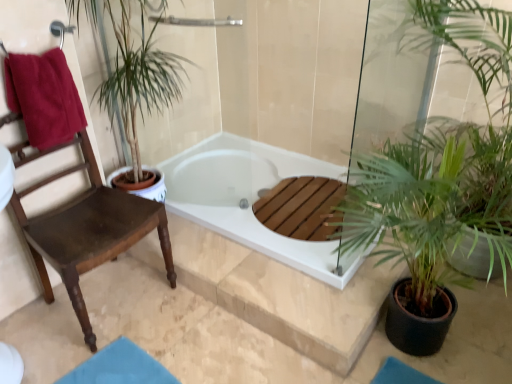
The height and width of the screenshot is (384, 512). I want to click on maroon cotton towel at left, so click(44, 97).

This screenshot has width=512, height=384. I want to click on white glossy bathtub at center, so click(250, 199).

Can you confirm if green leafy plant at right is smaller than maroon cotton towel at left?

No.

What's the angular difference between green leafy plant at right and maroon cotton towel at left's facing directions?

The angle between the facing direction of green leafy plant at right and the facing direction of maroon cotton towel at left is 89.3 degrees.

At what (x,y) coordinates should I click in order to perform the action: click on beach towel behind the green leafy plant at right. Please return your answer as a coordinate pair (x, y). Looking at the image, I should click on (44, 97).

From a real-world perspective, which is physically below, green leafy plant at right or maroon cotton towel at left?

In real-world perspective, green leafy plant at right is lower.

You are a GUI agent. You are given a task and a screenshot of the screen. Output one action in this format:
    pyautogui.click(x=<x>, y=<y>)
    Task: Click on the chair below the maroon cotton towel at left (from the image's perspective)
    
    Given the screenshot: What is the action you would take?
    pyautogui.click(x=86, y=228)

From the image's perspective, which object appears higher, wooden chair at left or maroon cotton towel at left?

maroon cotton towel at left, from the image's perspective.

Does wooden chair at left have a larger size compared to maroon cotton towel at left?

Yes.

Would you say wooden chair at left is outside maroon cotton towel at left?

wooden chair at left lies outside maroon cotton towel at left's area.

Where is `bathtub below the green leafy plant at right (from a real-world perspective)`? The width and height of the screenshot is (512, 384). bathtub below the green leafy plant at right (from a real-world perspective) is located at coordinates (250, 199).

Considering the positions of objects green leafy plant at right and white glossy bathtub at center in the image provided, who is more to the right, green leafy plant at right or white glossy bathtub at center?

Positioned to the right is green leafy plant at right.

From the image's perspective, which one is positioned higher, green leafy plant at right or white glossy bathtub at center?

green leafy plant at right, from the image's perspective.

Does green leafy plant at right have a lesser height compared to wooden chair at left?

Incorrect, the height of green leafy plant at right does not fall short of that of wooden chair at left.

Is green leafy plant at right not close to wooden chair at left?

Yes, green leafy plant at right is far from wooden chair at left.

Considering the positions of points (395, 245) and (80, 241), is point (395, 245) farther from camera compared to point (80, 241)?

Yes, point (395, 245) is behind point (80, 241).

Between green leafy plant at right and wooden chair at left, which one has larger size?

green leafy plant at right is bigger.

Is point (21, 197) positioned in front of point (264, 173)?

Yes, point (21, 197) is in front of point (264, 173).

Based on the photo, considering the relative positions of wooden chair at left and white glossy bathtub at center in the image provided, is wooden chair at left to the left or to the right of white glossy bathtub at center?

Based on their positions, wooden chair at left is located to the left of white glossy bathtub at center.

Considering the positions of objects wooden chair at left and white glossy bathtub at center in the image provided, who is in front, wooden chair at left or white glossy bathtub at center?

Positioned in front is wooden chair at left.

Considering the relative sizes of wooden chair at left and white glossy bathtub at center in the image provided, is wooden chair at left wider than white glossy bathtub at center?

In fact, wooden chair at left might be narrower than white glossy bathtub at center.

Between maroon cotton towel at left and green leafy plant at right, which one is positioned in front?

green leafy plant at right is more forward.

From a real-world perspective, between maroon cotton towel at left and green leafy plant at right, who is vertically higher?

From a 3D spatial view, maroon cotton towel at left is above.

Consider the image. Would you say maroon cotton towel at left is a long distance from green leafy plant at right?

Yes, maroon cotton towel at left is far from green leafy plant at right.

Consider the image. Considering the relative sizes of maroon cotton towel at left and green leafy plant at right in the image provided, is maroon cotton towel at left smaller than green leafy plant at right?

Correct, maroon cotton towel at left occupies less space than green leafy plant at right.

How many degrees apart are the facing directions of maroon cotton towel at left and white glossy bathtub at center?

88.9 degrees separate the facing orientations of maroon cotton towel at left and white glossy bathtub at center.

Is maroon cotton towel at left next to white glossy bathtub at center and touching it?

maroon cotton towel at left and white glossy bathtub at center are clearly separated.

Based on their sizes in the image, would you say maroon cotton towel at left is bigger or smaller than white glossy bathtub at center?

In the image, maroon cotton towel at left appears to be smaller than white glossy bathtub at center.

Between point (49, 123) and point (214, 167), which one is positioned in front?

The point (49, 123) is more forward.

Find the location of a particular element. This screenshot has width=512, height=384. beach towel that is above the green leafy plant at right (from the image's perspective) is located at coordinates (44, 97).

This screenshot has height=384, width=512. I want to click on chair beneath the maroon cotton towel at left (from a real-world perspective), so click(86, 228).

Which object lies further to the anchor point wooden chair at left, maroon cotton towel at left or white glossy bathtub at center?

The object further to wooden chair at left is white glossy bathtub at center.

Considering their positions, is green leafy plant at right positioned further to wooden chair at left than white glossy bathtub at center?

green leafy plant at right.

When comparing their distances from maroon cotton towel at left, does green leafy plant at right or wooden chair at left seem closer?

wooden chair at left.

When comparing their distances from maroon cotton towel at left, does green leafy plant at right or white glossy bathtub at center seem further?

The object further to maroon cotton towel at left is green leafy plant at right.

When comparing their distances from white glossy bathtub at center, does wooden chair at left or maroon cotton towel at left seem further?

maroon cotton towel at left is further to white glossy bathtub at center.

When comparing their distances from white glossy bathtub at center, does wooden chair at left or green leafy plant at right seem closer?

green leafy plant at right lies closer to white glossy bathtub at center than the other object.

Looking at the image, which one is located further to wooden chair at left, white glossy bathtub at center or maroon cotton towel at left?

Among the two, white glossy bathtub at center is located further to wooden chair at left.

When comparing their distances from green leafy plant at right, does wooden chair at left or white glossy bathtub at center seem closer?

white glossy bathtub at center.

Identify the location of chair between maroon cotton towel at left and green leafy plant at right in the horizontal direction. (86, 228).

This screenshot has height=384, width=512. Identify the location of chair between maroon cotton towel at left and white glossy bathtub at center from left to right. (86, 228).

Locate an element on the screen. bathtub between wooden chair at left and green leafy plant at right in the horizontal direction is located at coordinates (250, 199).

Where is `bathtub between maroon cotton towel at left and green leafy plant at right from left to right`? The width and height of the screenshot is (512, 384). bathtub between maroon cotton towel at left and green leafy plant at right from left to right is located at coordinates (250, 199).